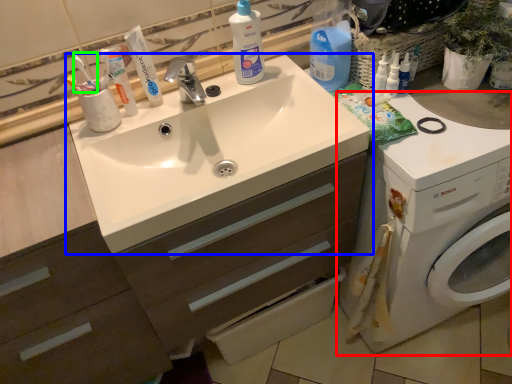
Question: Considering the real-world distances, which object is farthest from washing machine (highlighted by a red box)? sink (highlighted by a blue box) or toothbrush (highlighted by a green box)?

Choices:
 (A) sink
 (B) toothbrush

Answer: (B)